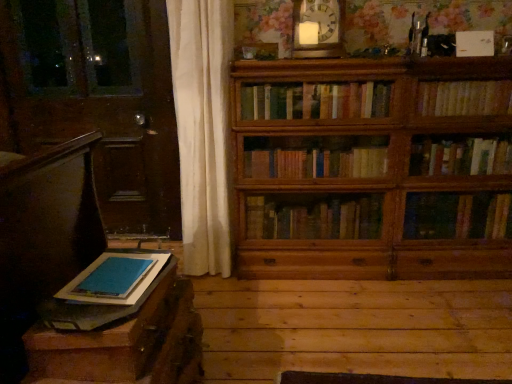
Question: Is wooden bookshelf at right, which ranks as the 1th book in right-to-left order, further to the viewer compared to wooden table at lower left?

Choices:
 (A) yes
 (B) no

Answer: (A)

Question: Is wooden bookshelf at right, which ranks as the 1th book in right-to-left order, directly adjacent to wooden table at lower left?

Choices:
 (A) no
 (B) yes

Answer: (A)

Question: Can wooden table at lower left be found inside wooden bookshelf at right, placed as the first book when sorted from back to front?

Choices:
 (A) yes
 (B) no

Answer: (B)

Question: Considering the relative sizes of wooden bookshelf at right, the 2th book in the left-to-right sequence, and wooden table at lower left in the image provided, is wooden bookshelf at right, the 2th book in the left-to-right sequence, taller than wooden table at lower left?

Choices:
 (A) no
 (B) yes

Answer: (B)

Question: Is wooden bookshelf at right, arranged as the 2th book when viewed from the front, not within wooden table at lower left?

Choices:
 (A) no
 (B) yes

Answer: (B)

Question: In the image, is wooden clock at upper center positioned in front of or behind wooden bookshelf at right, which ranks as the 1th book in right-to-left order?

Choices:
 (A) behind
 (B) front

Answer: (B)

Question: Is wooden clock at upper center to the left or to the right of wooden bookshelf at right, which ranks as the first book in top-to-bottom order, in the image?

Choices:
 (A) left
 (B) right

Answer: (A)

Question: Considering the positions of wooden clock at upper center and wooden bookshelf at right, arranged as the 2th book when viewed from the front, in the image, is wooden clock at upper center wider or thinner than wooden bookshelf at right, arranged as the 2th book when viewed from the front,?

Choices:
 (A) wide
 (B) thin

Answer: (A)

Question: Looking at the image, does wooden clock at upper center seem bigger or smaller compared to wooden bookshelf at right, placed as the first book when sorted from back to front?

Choices:
 (A) big
 (B) small

Answer: (B)

Question: Looking at the image, does wooden clock at upper center seem bigger or smaller compared to wooden table at lower left?

Choices:
 (A) big
 (B) small

Answer: (B)

Question: Considering the positions of point (342, 46) and point (147, 288), is point (342, 46) closer or farther from the camera than point (147, 288)?

Choices:
 (A) closer
 (B) farther

Answer: (B)

Question: Is wooden clock at upper center in front of or behind wooden table at lower left in the image?

Choices:
 (A) front
 (B) behind

Answer: (B)

Question: Based on their positions, is wooden clock at upper center located to the left or right of wooden table at lower left?

Choices:
 (A) left
 (B) right

Answer: (B)

Question: Considering their positions, is blue felt book at lower left, which is the second book in right-to-left order, located in front of or behind dark brown leather armchair at left?

Choices:
 (A) behind
 (B) front

Answer: (A)

Question: Based on their positions, is blue felt book at lower left, arranged as the second book when viewed from the back, located to the left or right of dark brown leather armchair at left?

Choices:
 (A) right
 (B) left

Answer: (A)